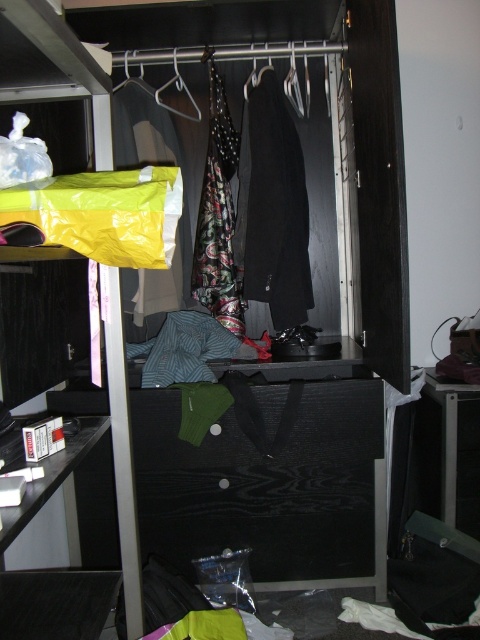
Is black wood drawer at center smaller than black fabric hanger at center?

Actually, black wood drawer at center might be larger than black fabric hanger at center.

Is black wood drawer at center closer to the viewer compared to black fabric hanger at center?

Yes, it is.

Identify the location of black wood drawer at center. (269, 484).

Find the location of a particular element. black wood drawer at center is located at coordinates (269, 484).

Between metallic silver hanger at center and black fabric hanger at center, which one is positioned lower?

Positioned lower is metallic silver hanger at center.

Who is taller, metallic silver hanger at center or black fabric hanger at center?

With more height is metallic silver hanger at center.

The image size is (480, 640). What do you see at coordinates (178, 90) in the screenshot?
I see `metallic silver hanger at center` at bounding box center [178, 90].

Where is `metallic silver hanger at center`? The width and height of the screenshot is (480, 640). metallic silver hanger at center is located at coordinates (178, 90).

Find the location of a particular element. black wood drawer at center is located at coordinates (269, 484).

This screenshot has height=640, width=480. I want to click on black wood drawer at center, so click(x=269, y=484).

This screenshot has height=640, width=480. I want to click on black wood drawer at center, so click(269, 484).